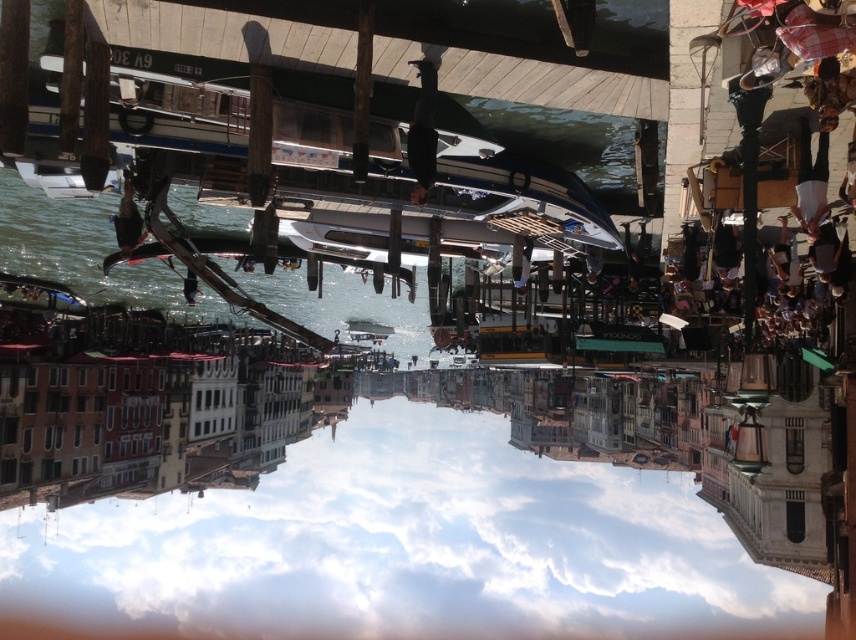
Can you confirm if clear water at lower left is shorter than metallic silver boat at center?

Incorrect, clear water at lower left's height does not fall short of metallic silver boat at center's.

Does clear water at lower left have a greater height compared to metallic silver boat at center?

Yes, clear water at lower left is taller than metallic silver boat at center.

You are a GUI agent. You are given a task and a screenshot of the screen. Output one action in this format:
    pyautogui.click(x=<x>, y=<y>)
    Task: Click on the clear water at lower left
    This screenshot has height=640, width=856.
    Given the screenshot: What is the action you would take?
    pyautogui.click(x=85, y=250)

Between metallic silver boat at center and white glossy boat at center, which one has less height?

Standing shorter between the two is white glossy boat at center.

Does metallic silver boat at center lie behind white glossy boat at center?

No, it is not.

Between point (586, 195) and point (379, 326), which one is positioned in front?

Positioned in front is point (586, 195).

Locate an element on the screen. The image size is (856, 640). metallic silver boat at center is located at coordinates (515, 188).

Looking at this image, which is more to the right, clear water at lower left or white glossy boat at center?

white glossy boat at center

Is point (349, 285) farther from viewer compared to point (354, 321)?

No, it is in front of (354, 321).

Locate an element on the screen. The width and height of the screenshot is (856, 640). clear water at lower left is located at coordinates (85, 250).